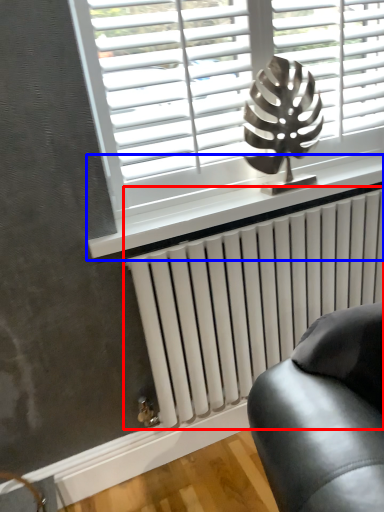
Question: Which point is closer to the camera, radiator (highlighted by a red box) or window sill (highlighted by a blue box)?

Choices:
 (A) radiator
 (B) window sill

Answer: (B)